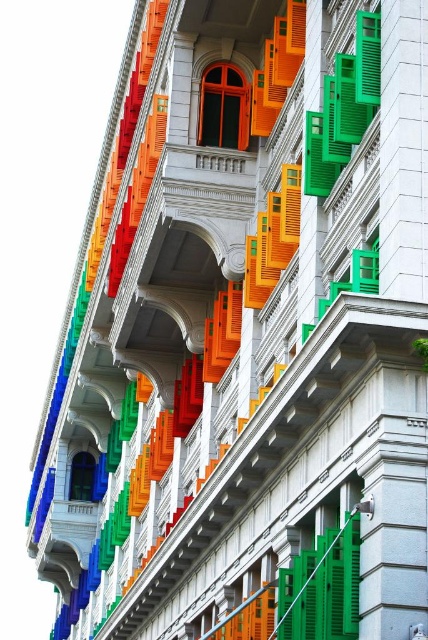
You are an architect designing a new building inspired by this facade. You want to ensure that the matte orange window at center and the blue glass window at center are proportionally scaled. Which window should have a wider design?

The matte orange window at center should have a wider design since its width is larger than the blue glass window at center according to the description.

You are standing in front of a building with colorful shutters. You see a matte orange window at center and a blue glass window at center. Which window is positioned to the right side?

The matte orange window at center is positioned to the right of the blue glass window at center.